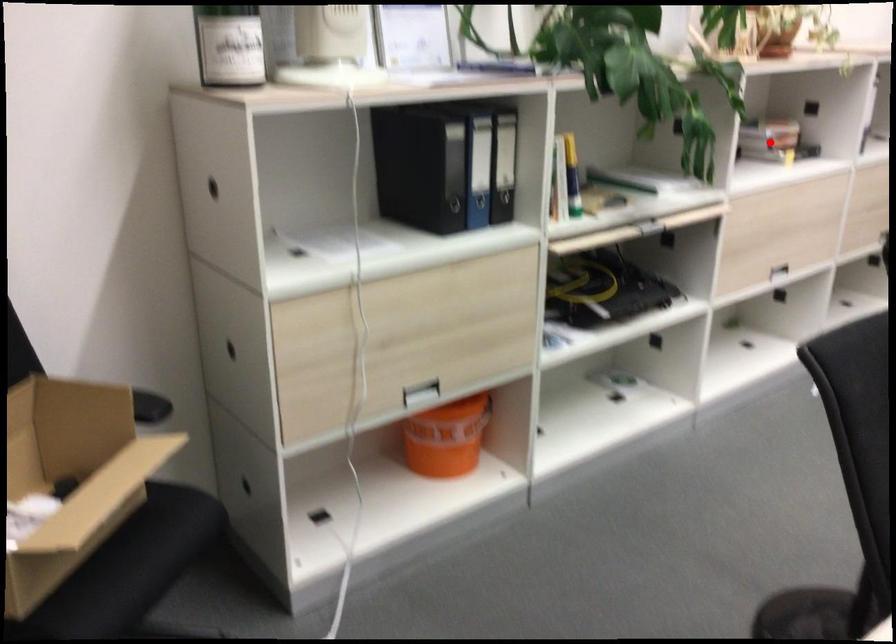
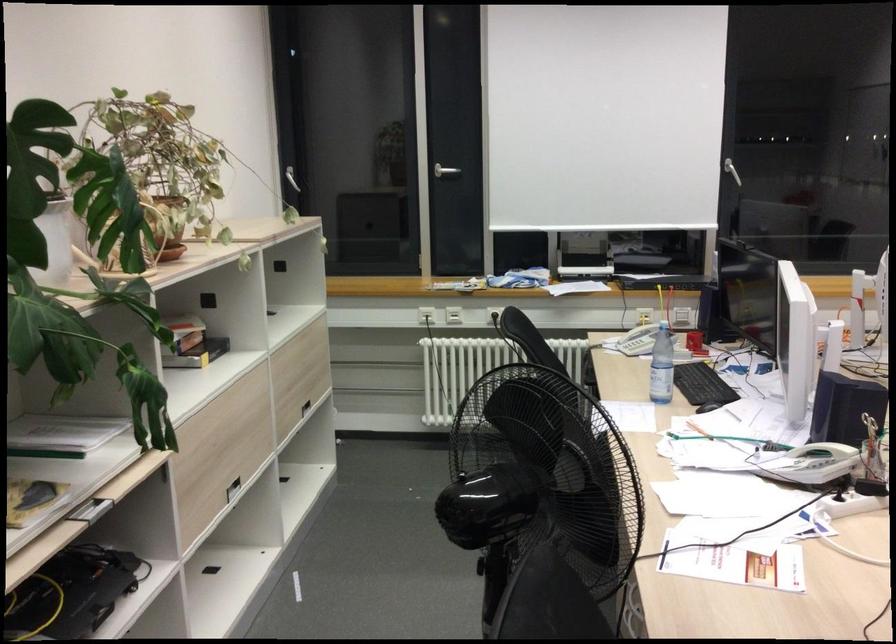
Locate, in the second image, the point that corresponds to the highlighted location in the first image.

(192, 343)